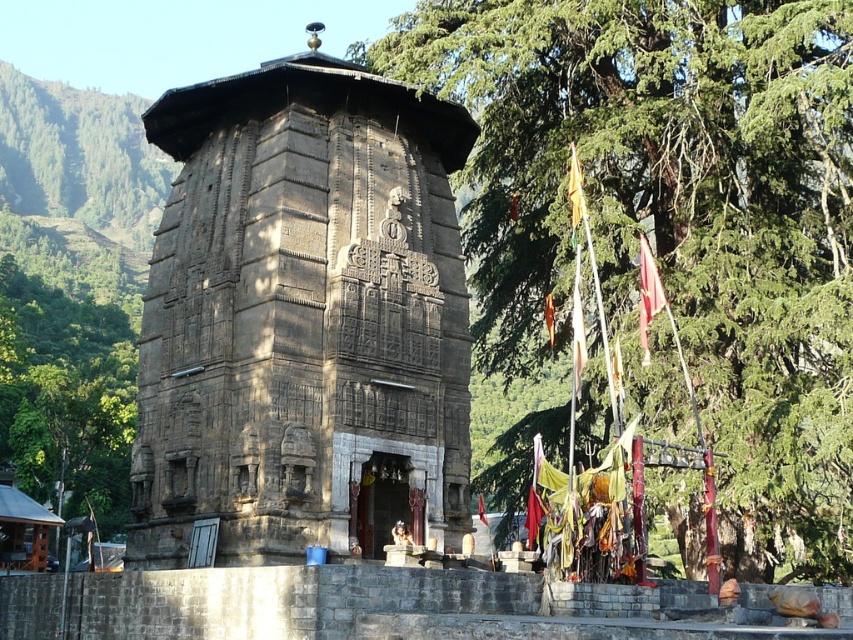
Question: Which object appears closest to the camera in this image?

Choices:
 (A) green leafy tree at upper center
 (B) brown stone temple at center
 (C) green leafy tree at center

Answer: (B)

Question: Among these points, which one is farthest from the camera?

Choices:
 (A) (424, 58)
 (B) (65, 372)
 (C) (378, 92)

Answer: (B)

Question: Is brown stone temple at center above green leafy tree at center?

Choices:
 (A) no
 (B) yes

Answer: (B)

Question: Which of the following is the farthest from the observer?

Choices:
 (A) (482, 208)
 (B) (103, 538)
 (C) (271, 552)

Answer: (B)

Question: Is brown stone temple at center above green leafy tree at center?

Choices:
 (A) no
 (B) yes

Answer: (B)

Question: Can you confirm if green leafy tree at upper center is thinner than green leafy tree at center?

Choices:
 (A) no
 (B) yes

Answer: (A)